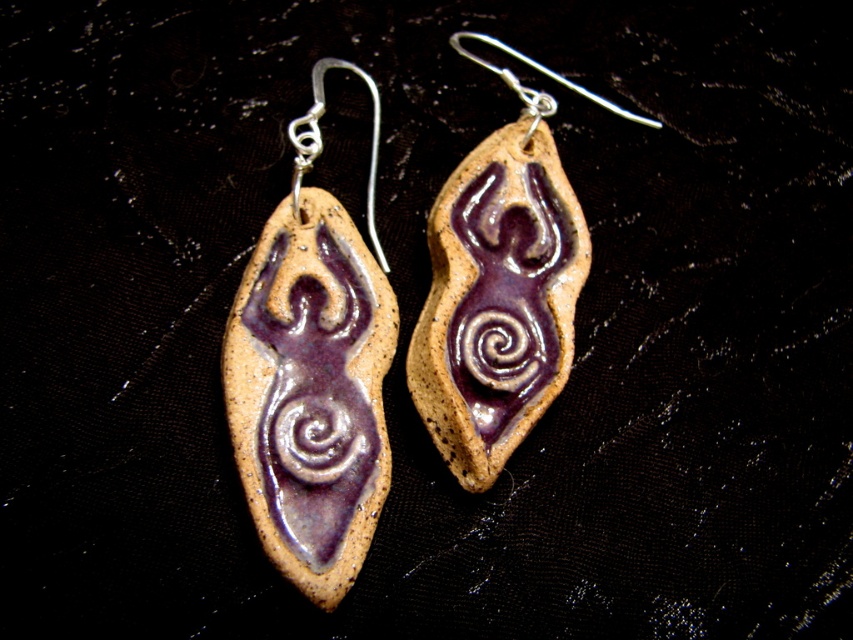
Question: Can you confirm if purple clay earring at center is wider than polished silver hook at upper center?

Choices:
 (A) no
 (B) yes

Answer: (B)

Question: Considering the real-world distances, which object is closest to the purple clay earring at center?

Choices:
 (A) matte purple clay earring at left
 (B) polished silver hook at upper center

Answer: (A)

Question: Does matte purple clay earring at left appear over polished silver hook at upper center?

Choices:
 (A) no
 (B) yes

Answer: (A)

Question: Does matte purple clay earring at left come behind polished silver hook at upper center?

Choices:
 (A) yes
 (B) no

Answer: (B)

Question: Among these objects, which one is nearest to the camera?

Choices:
 (A) purple clay earring at center
 (B) polished silver hook at upper center

Answer: (A)

Question: Which point is closer to the camera?

Choices:
 (A) (517, 54)
 (B) (502, 257)

Answer: (B)